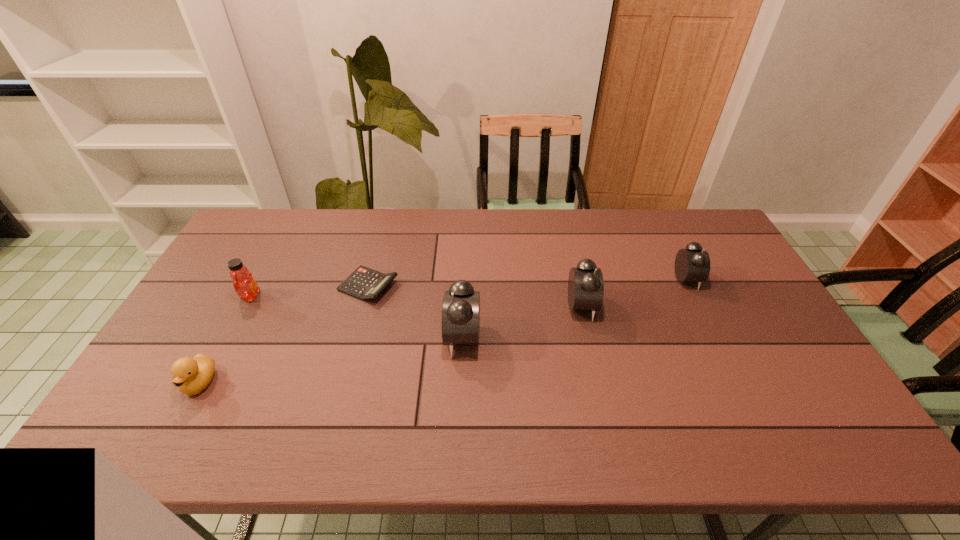
The width and height of the screenshot is (960, 540). Identify the location of the leftmost alarm clock. (460, 321).

Locate an element on the screen. The image size is (960, 540). the second alarm clock from right to left is located at coordinates click(x=585, y=284).

Locate an element on the screen. the fifth object from left to right is located at coordinates pyautogui.click(x=585, y=284).

Find the location of a particular element. This screenshot has width=960, height=540. the rightmost object is located at coordinates click(x=692, y=264).

Locate an element on the screen. This screenshot has height=540, width=960. the shortest alarm clock is located at coordinates (692, 264).

I want to click on honey, so click(x=244, y=284).

You are a GUI agent. You are given a task and a screenshot of the screen. Output one action in this format:
    pyautogui.click(x=<x>, y=<y>)
    Task: Click on the fifth tallest object
    The height and width of the screenshot is (540, 960).
    Given the screenshot: What is the action you would take?
    pyautogui.click(x=191, y=375)

Find the location of a particular element. duckling is located at coordinates (191, 375).

Locate an element on the screen. Image resolution: width=960 pixels, height=540 pixels. the shortest object is located at coordinates (364, 283).

This screenshot has width=960, height=540. Find the location of `calculator`. calculator is located at coordinates (364, 283).